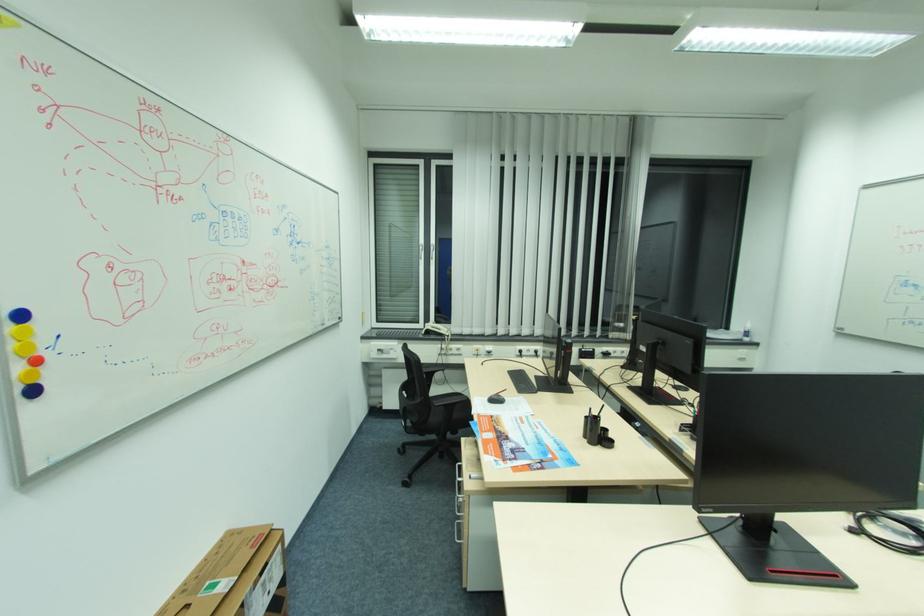
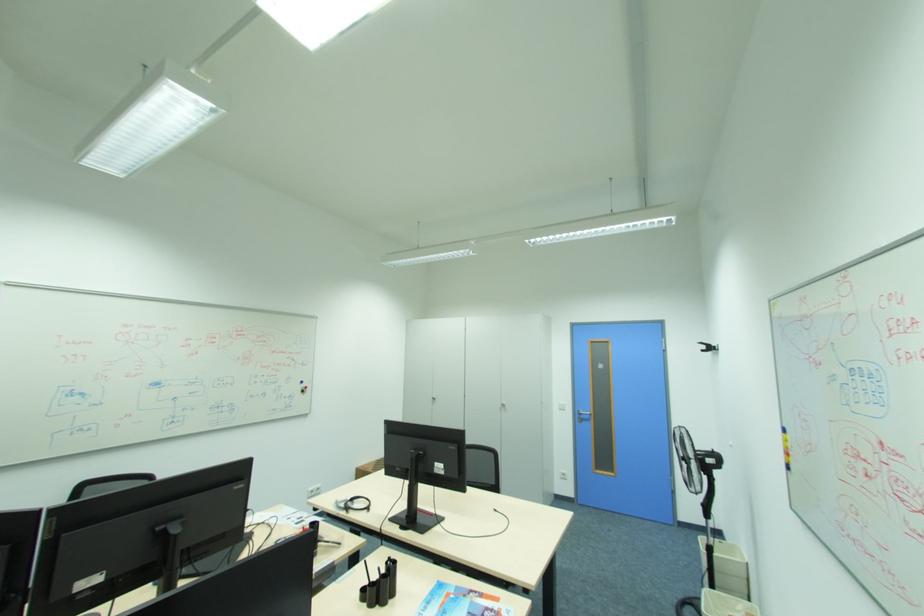
Locate, in the second image, the point that corresponds to (596,408) in the first image.

(383, 570)